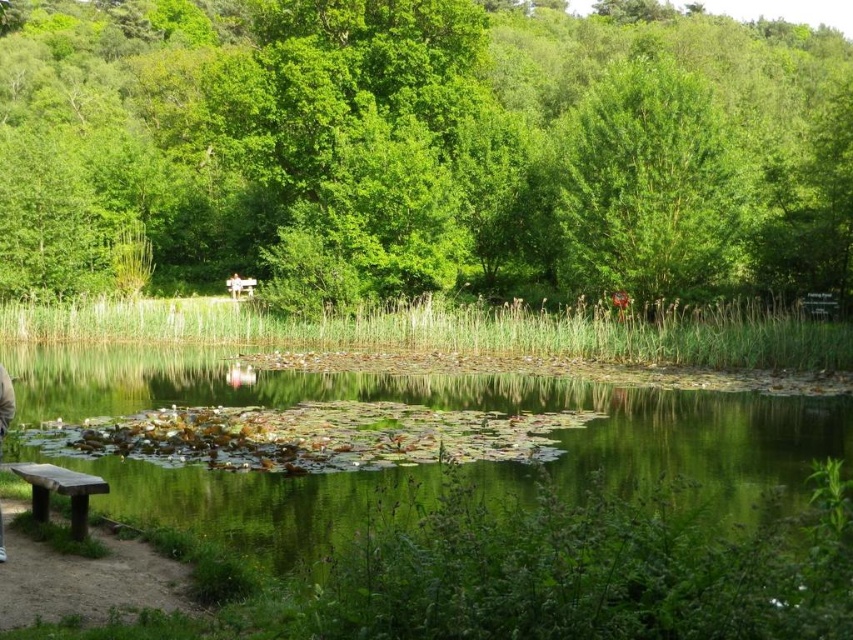
Does green leafy tree at center have a lesser height compared to brown dirt path at lower left?

Incorrect, green leafy tree at center's height does not fall short of brown dirt path at lower left's.

Is green leafy tree at center smaller than brown dirt path at lower left?

Actually, green leafy tree at center might be larger than brown dirt path at lower left.

Does point (85, 154) lie in front of point (26, 580)?

No, (85, 154) is further to viewer.

This screenshot has height=640, width=853. Identify the location of green leafy tree at center. coord(421,150).

Image resolution: width=853 pixels, height=640 pixels. What are the coordinates of `green leafy tree at center` in the screenshot? It's located at (421, 150).

Identify the location of green leafy tree at center. (421, 150).

Where is `green leafy tree at center`? This screenshot has height=640, width=853. green leafy tree at center is located at coordinates (421, 150).

Consider the image. Is green leafy tree at center further to the viewer compared to wooden bench at center?

Answer: No, green leafy tree at center is in front of wooden bench at center.

Does point (752, 51) come farther from viewer compared to point (253, 285)?

Yes, point (752, 51) is farther from viewer.

You are a GUI agent. You are given a task and a screenshot of the screen. Output one action in this format:
    pyautogui.click(x=<x>, y=<y>)
    Task: Click on the green leafy tree at center
    
    Given the screenshot: What is the action you would take?
    pyautogui.click(x=421, y=150)